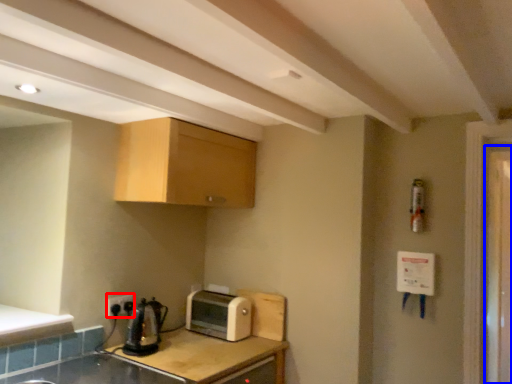
Question: Which point is closer to the camera, electric outlet (highlighted by a red box) or screen door (highlighted by a blue box)?

Choices:
 (A) electric outlet
 (B) screen door

Answer: (A)